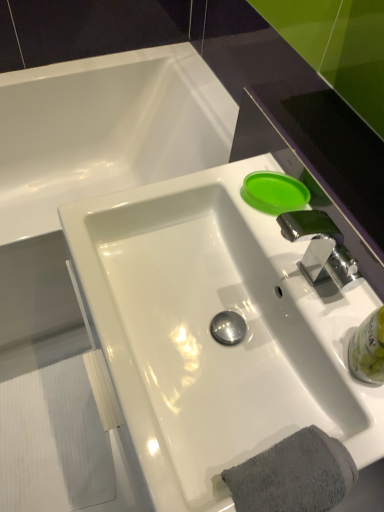
The width and height of the screenshot is (384, 512). What are the coordinates of `free area in between green matte lid at upper right, which is counted as the second liquid, starting from the bottom, and clear plastic bottle at lower right, the second liquid positioned from the back` in the screenshot? It's located at (311, 274).